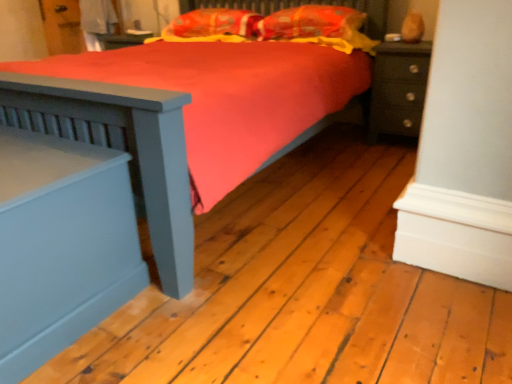
Question: Can you confirm if matte blue nightstand at left, which ranks as the second nightstand in back-to-front order, is bigger than orange fabric pillow at upper center, which appears as the 2th pillow when viewed from the right?

Choices:
 (A) no
 (B) yes

Answer: (B)

Question: Is matte blue nightstand at left, the first nightstand when ordered from front to back, outside of orange fabric pillow at upper center, the 1th pillow in the left-to-right sequence?

Choices:
 (A) no
 (B) yes

Answer: (B)

Question: Is matte blue nightstand at left, acting as the 2th nightstand starting from the right, facing away from orange fabric pillow at upper center, which appears as the 2th pillow when viewed from the right?

Choices:
 (A) no
 (B) yes

Answer: (B)

Question: Does matte blue nightstand at left, which ranks as the second nightstand in back-to-front order, appear on the right side of orange fabric pillow at upper center, the 1th pillow in the left-to-right sequence?

Choices:
 (A) no
 (B) yes

Answer: (A)

Question: Is matte blue nightstand at left, the first nightstand when ordered from front to back, aimed at orange fabric pillow at upper center, the 1th pillow in the left-to-right sequence?

Choices:
 (A) yes
 (B) no

Answer: (B)

Question: From a real-world perspective, is matte dark green nightstand at right, the second nightstand ordered from the bottom, positioned above or below matte blue nightstand at left, the 2th nightstand when ordered from top to bottom?

Choices:
 (A) above
 (B) below

Answer: (A)

Question: Considering the positions of matte dark green nightstand at right, which is the second nightstand in front-to-back order, and matte blue nightstand at left, which is counted as the first nightstand, starting from the left, in the image, is matte dark green nightstand at right, which is the second nightstand in front-to-back order, taller or shorter than matte blue nightstand at left, which is counted as the first nightstand, starting from the left,?

Choices:
 (A) short
 (B) tall

Answer: (B)

Question: Is point (418, 54) positioned closer to the camera than point (88, 256)?

Choices:
 (A) closer
 (B) farther

Answer: (B)

Question: In the image, is matte dark green nightstand at right, the second nightstand ordered from the bottom, on the left side or the right side of matte blue nightstand at left, the 2th nightstand when ordered from top to bottom?

Choices:
 (A) right
 (B) left

Answer: (A)

Question: Is orange fabric pillow at upper center, arranged as the 1th pillow when viewed from the right, wider or thinner than matte dark green nightstand at right, the second nightstand ordered from the bottom?

Choices:
 (A) thin
 (B) wide

Answer: (A)

Question: Do you think orange fabric pillow at upper center, which is counted as the second pillow, starting from the left, is within matte dark green nightstand at right, the first nightstand viewed from the right, or outside of it?

Choices:
 (A) outside
 (B) inside

Answer: (A)

Question: Considering the positions of point (317, 29) and point (378, 79), is point (317, 29) closer or farther from the camera than point (378, 79)?

Choices:
 (A) closer
 (B) farther

Answer: (B)

Question: Is orange fabric pillow at upper center, which is counted as the second pillow, starting from the left, in front of or behind matte dark green nightstand at right, which is the second nightstand in front-to-back order, in the image?

Choices:
 (A) behind
 (B) front

Answer: (A)

Question: Does point (232, 18) appear closer or farther from the camera than point (380, 120)?

Choices:
 (A) farther
 (B) closer

Answer: (A)

Question: Is orange fabric pillow at upper center, the 1th pillow in the left-to-right sequence, to the left or to the right of matte dark green nightstand at right, which is the second nightstand from left to right, in the image?

Choices:
 (A) left
 (B) right

Answer: (A)